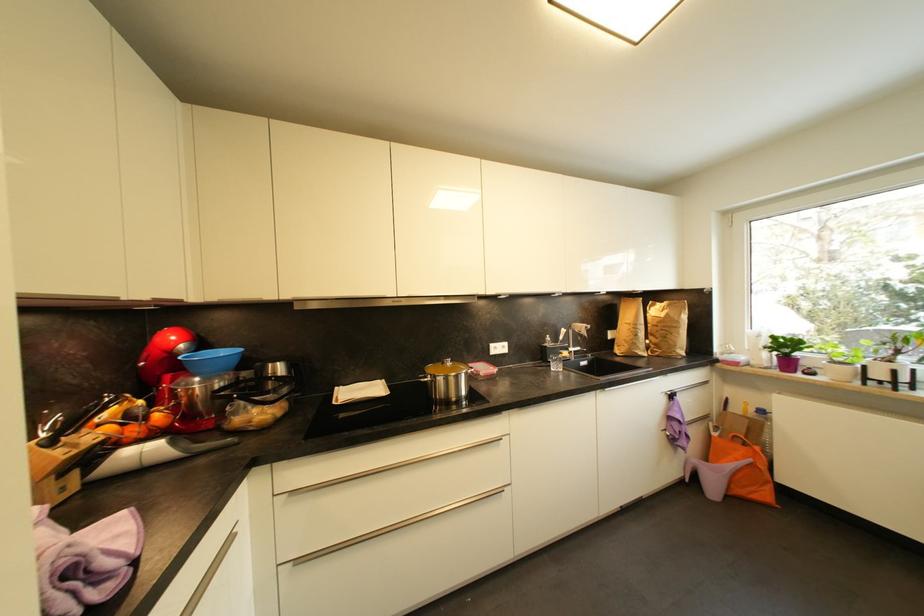
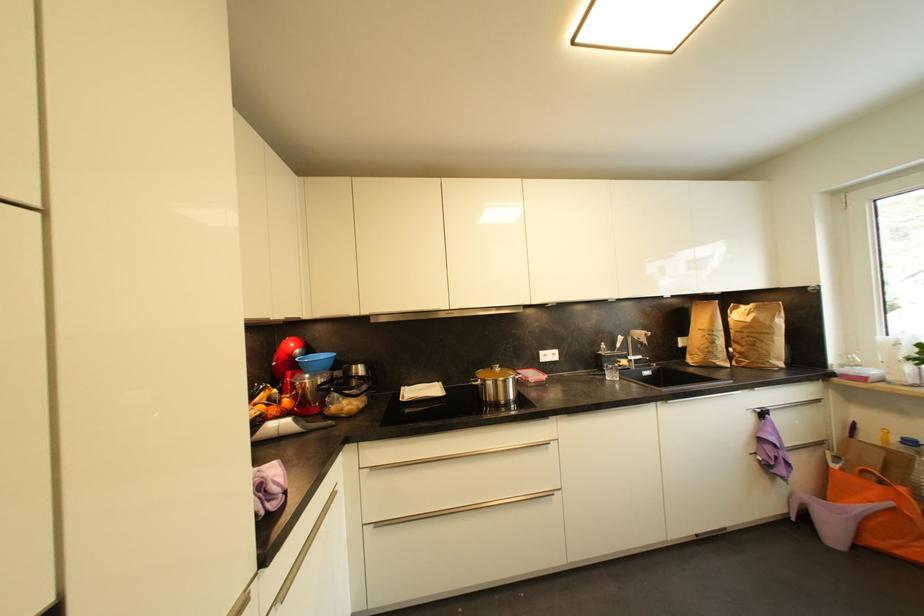
In the second image, find the point that corresponds to (x=701, y=463) in the first image.

(811, 498)